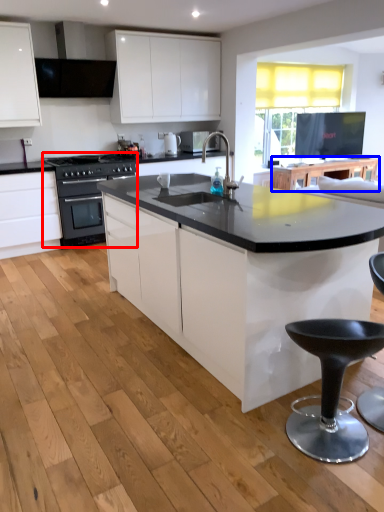
Question: Which of the following is the farthest to the observer, kitchen appliance (highlighted by a red box) or table (highlighted by a blue box)?

Choices:
 (A) kitchen appliance
 (B) table

Answer: (B)